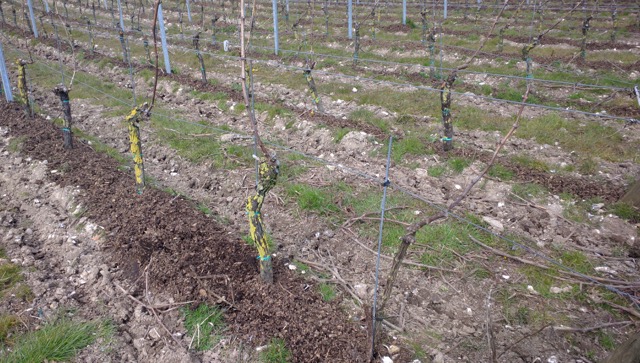
The height and width of the screenshot is (363, 640). In order to click on white divider in this screenshot , I will do `click(227, 46)`.